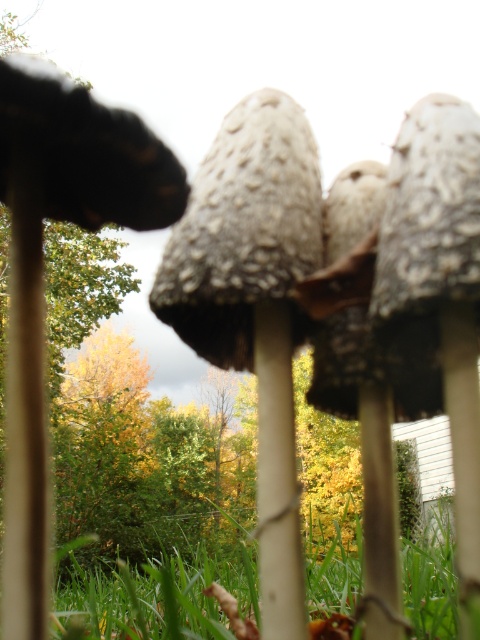
Does green grass at lower center appear under white smooth stem at center?

Yes.

Between green grass at lower center and white smooth stem at center, which one has less height?

Standing shorter between the two is green grass at lower center.

The width and height of the screenshot is (480, 640). What do you see at coordinates (156, 598) in the screenshot?
I see `green grass at lower center` at bounding box center [156, 598].

In order to click on green grass at lower center in this screenshot , I will do `click(156, 598)`.

Consider the image. Is brown matte stem at left below smooth white stem at center?

Actually, brown matte stem at left is above smooth white stem at center.

Which is behind, point (29, 228) or point (392, 516)?

The point (392, 516) is more distant.

You are a GUI agent. You are given a task and a screenshot of the screen. Output one action in this format:
    pyautogui.click(x=<x>, y=<y>)
    Task: Click on the brown matte stem at left
    The width and height of the screenshot is (480, 640).
    Given the screenshot: What is the action you would take?
    24,432

Where is `brown matte stem at left`? This screenshot has width=480, height=640. brown matte stem at left is located at coordinates (24, 432).

Is point (70, 552) less distant than point (39, 304)?

No, it is not.

In the scene shown: Who is higher up, green grass at lower center or brown matte stem at left?

Positioned higher is brown matte stem at left.

Who is more forward, (x=328, y=552) or (x=45, y=492)?

Positioned in front is point (x=45, y=492).

Locate an element on the screen. This screenshot has width=480, height=640. green grass at lower center is located at coordinates point(156,598).